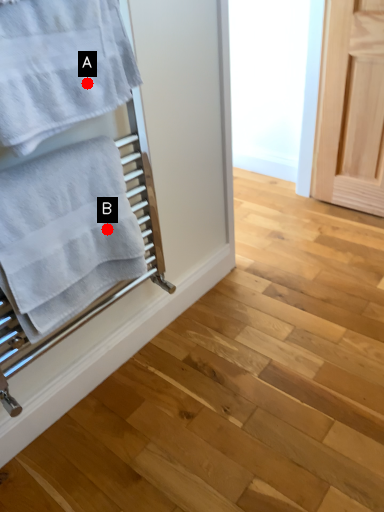
Question: Two points are circled on the image, labeled by A and B beside each circle. Which point is closer to the camera?

Choices:
 (A) A is closer
 (B) B is closer

Answer: (A)